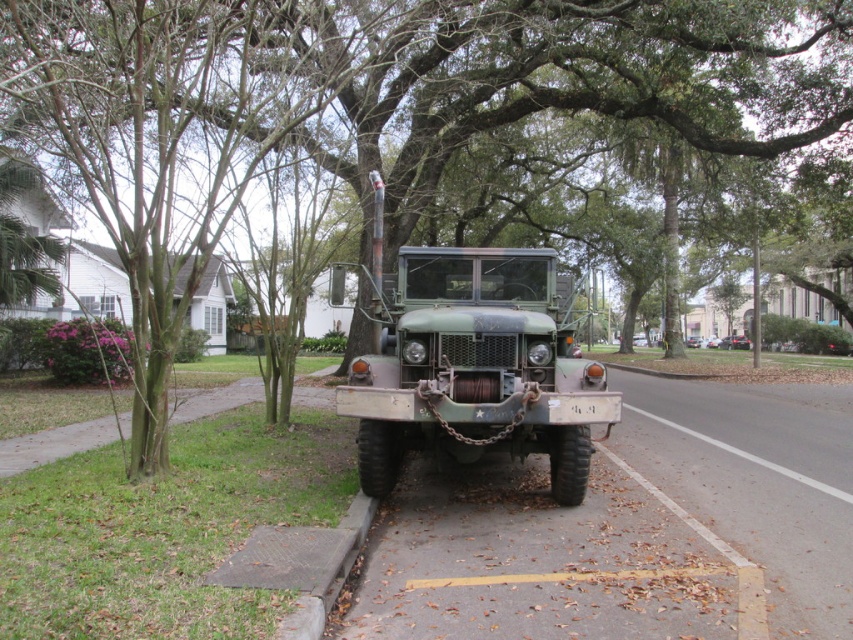
You are a pedestrian standing on the sidewalk near the green matte truck at center and the matte green truck at center. Which truck is closer to you?

The green matte truck at center is closer to the pedestrian than the matte green truck at center.

Consider the image. You are a delivery driver who needs to park your van on the street where the green matte truck at center and the matte green truck at center are parked. Which truck should you park to the right of to ensure proper spacing?

You should park to the right of the green matte truck at center because it is positioned to the left of the matte green truck at center, allowing for proper spacing between vehicles.